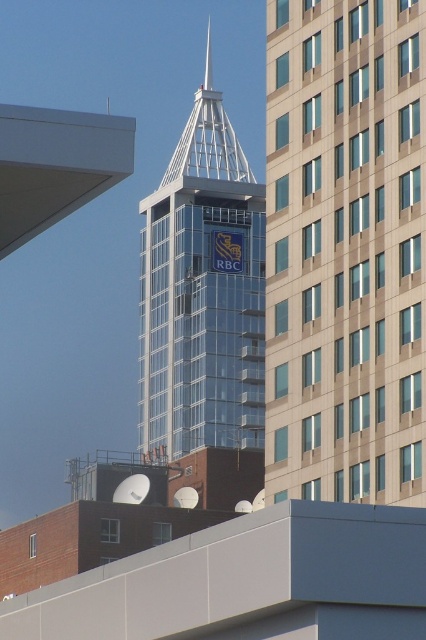
You are standing in the city looking at the beige glass building at center and the clear glass tower at center. Which one is positioned to the right side?

The beige glass building at center is positioned to the right of the clear glass tower at center.

You are a drone operator tasked with flying a drone between the beige glass building at center and the clear glass tower at center. The drone has a maximum flight distance of 80 meters. Can the drone safely fly between them without exceeding its range?

The distance between the beige glass building at center and the clear glass tower at center is 79.33 meters, which is within the drone operator maximum flight distance of 80 meters. Therefore, the drone can safely fly between them without exceeding its range.

You are standing in the city and want to take a photo of the point located at coordinate point (x=334, y=8). The camera you have can focus on objects up to 80 meters away. Will the point be in focus?

The point at coordinate point (x=334, y=8) is 79.19 meters away from the camera, which is within the camera focus range of 80 meters. Therefore, the point will be in focus.